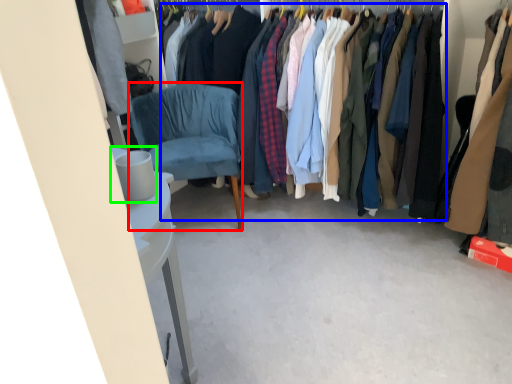
Question: Based on their relative distances, which object is nearer to chair (highlighted by a red box)? Choose from clothing (highlighted by a blue box) and trash bin/can (highlighted by a green box).

Choices:
 (A) clothing
 (B) trash bin/can

Answer: (A)